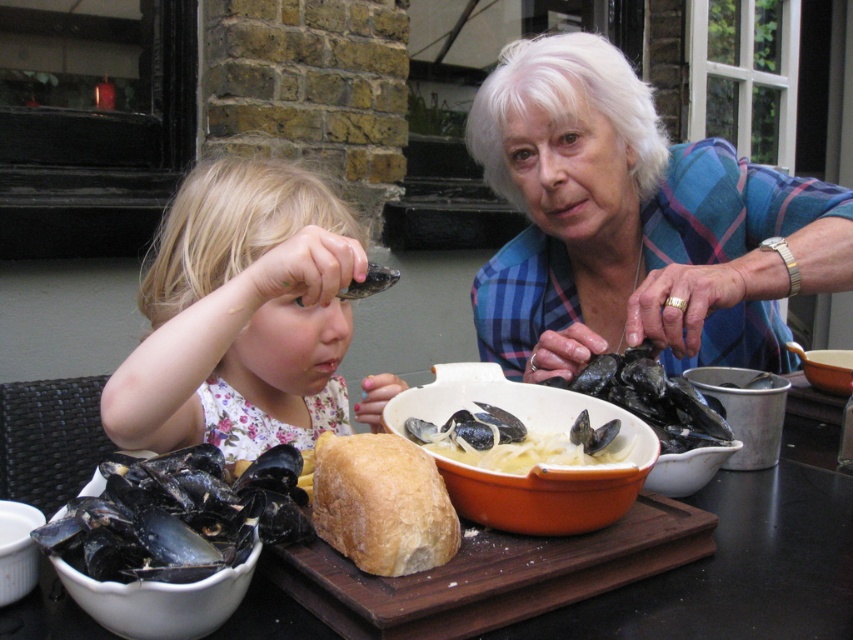
Is orange ceramic bowl at center positioned before black glossy oyster at center?

Yes.

Is orange ceramic bowl at center below black glossy oyster at center?

Correct, orange ceramic bowl at center is located below black glossy oyster at center.

Between point (547, 470) and point (595, 356), which one is positioned behind?

Positioned behind is point (595, 356).

Identify the location of orange ceramic bowl at center. (534, 465).

Between point (717, 209) and point (231, 609), which one is positioned behind?

Positioned behind is point (717, 209).

The image size is (853, 640). Identify the location of blue plaid shirt at upper right. coord(633,225).

Is the position of golden brown crusty loaf of bread at center more distant than that of white ceramic bowl at lower left?

No, golden brown crusty loaf of bread at center is closer to the viewer.

Can you confirm if golden brown crusty loaf of bread at center is shorter than white ceramic bowl at lower left?

Incorrect, golden brown crusty loaf of bread at center's height does not fall short of white ceramic bowl at lower left's.

Who is more distant from viewer, (457, 525) or (18, 552)?

The point (457, 525) is more distant.

You are a GUI agent. You are given a task and a screenshot of the screen. Output one action in this format:
    pyautogui.click(x=<x>, y=<y>)
    Task: Click on the golden brown crusty loaf of bread at center
    
    Given the screenshot: What is the action you would take?
    pyautogui.click(x=381, y=502)